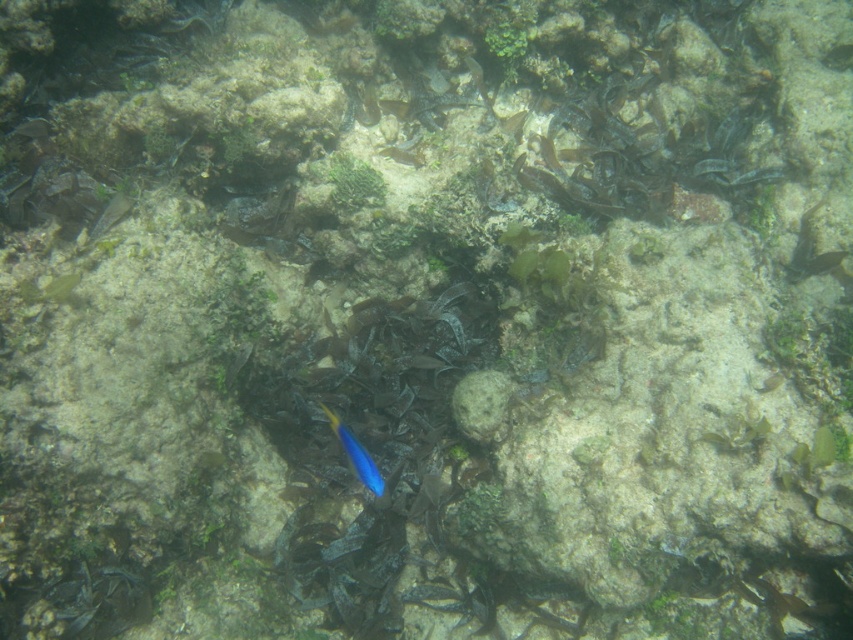
Question: Which point is farther to the camera?

Choices:
 (A) white matte rock at center
 (B) blue glossy fish at center

Answer: (B)

Question: In this image, where is white matte rock at center located relative to blue glossy fish at center?

Choices:
 (A) above
 (B) below

Answer: (A)

Question: Considering the relative positions of white matte rock at center and blue glossy fish at center in the image provided, where is white matte rock at center located with respect to blue glossy fish at center?

Choices:
 (A) left
 (B) right

Answer: (B)

Question: Can you confirm if white matte rock at center is smaller than blue glossy fish at center?

Choices:
 (A) no
 (B) yes

Answer: (B)